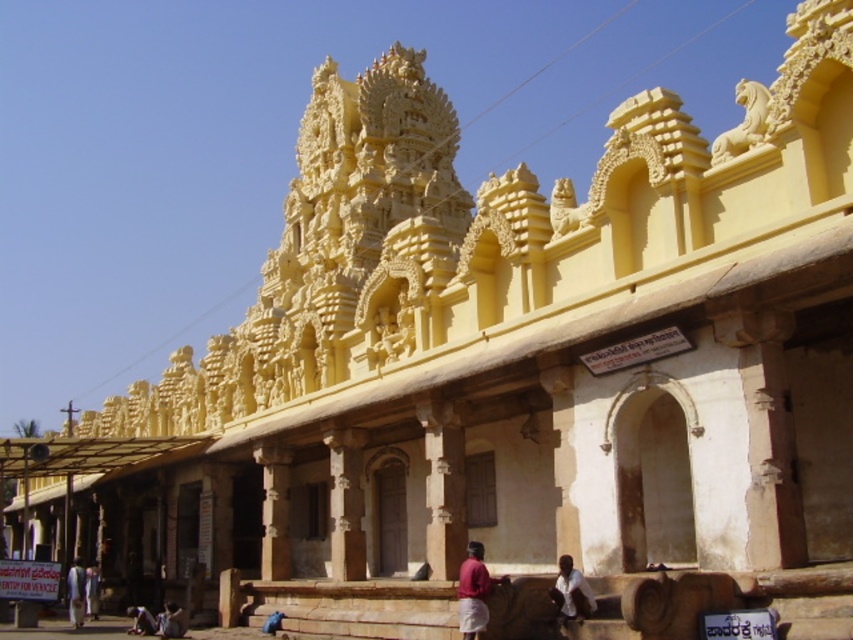
Is matte red cloth at lower right positioned at the back of light blue fabric pants at lower left?

No.

Is matte red cloth at lower right smaller than light blue fabric pants at lower left?

Correct, matte red cloth at lower right occupies less space than light blue fabric pants at lower left.

At what (x,y) coordinates should I click in order to perform the action: click on matte red cloth at lower right. Please return your answer as a coordinate pair (x, y). Looking at the image, I should click on [474, 592].

Where is `matte red cloth at lower right`? This screenshot has width=853, height=640. matte red cloth at lower right is located at coordinates [474, 592].

Is point (469, 596) in front of point (572, 592)?

No, it is not.

Does matte red cloth at lower right have a lesser height compared to white cotton cloth at lower center?

Incorrect, matte red cloth at lower right's height does not fall short of white cotton cloth at lower center's.

Between point (488, 582) and point (577, 600), which one is positioned in front?

Positioned in front is point (577, 600).

Find the location of a particular element. This screenshot has width=853, height=640. matte red cloth at lower right is located at coordinates (474, 592).

In the scene shown: Is matte red cloth at lower right shorter than white fabric person at lower left?

Yes, matte red cloth at lower right is shorter than white fabric person at lower left.

How far apart are matte red cloth at lower right and white fabric person at lower left?

43.02 meters

Does point (466, 568) come closer to viewer compared to point (86, 604)?

Yes, it is in front of point (86, 604).

The height and width of the screenshot is (640, 853). I want to click on matte red cloth at lower right, so [x=474, y=592].